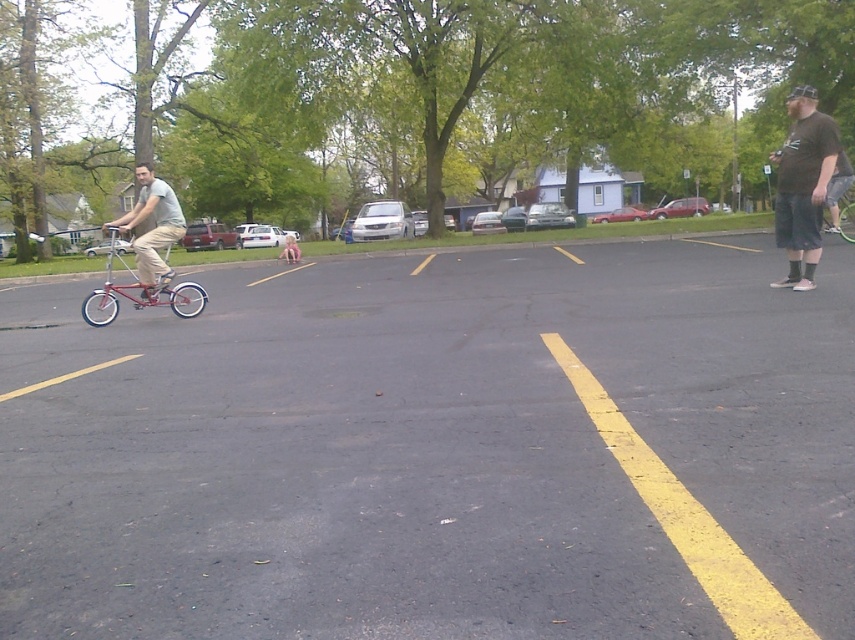
You are a GUI agent. You are given a task and a screenshot of the screen. Output one action in this format:
    pyautogui.click(x=<x>, y=<y>)
    Task: Click on the metallic silver bicycle at left
    
    Given the screenshot: What is the action you would take?
    pyautogui.click(x=152, y=227)

Is metallic silver bicycle at left taller than metallic silver bicycle at right?

Yes.

Who is more distant from viewer, (137, 172) or (828, 225)?

The point (828, 225) is behind.

I want to click on metallic silver bicycle at left, so click(152, 227).

In the scene shown: Is the position of metallic silver bicycle at left less distant than that of shiny red bicycle at left?

Yes, it is in front of shiny red bicycle at left.

Who is lower down, metallic silver bicycle at left or shiny red bicycle at left?

shiny red bicycle at left is lower down.

Locate an element on the screen. This screenshot has width=855, height=640. metallic silver bicycle at left is located at coordinates (152, 227).

At what (x,y) coordinates should I click in order to perform the action: click on metallic silver bicycle at left. Please return your answer as a coordinate pair (x, y). This screenshot has width=855, height=640. Looking at the image, I should click on (152, 227).

Is black asphalt parking lot at center to the right of metallic silver bicycle at left from the viewer's perspective?

Indeed, black asphalt parking lot at center is positioned on the right side of metallic silver bicycle at left.

Between point (534, 333) and point (145, 168), which one is positioned in front?

Point (534, 333) is more forward.

The image size is (855, 640). I want to click on black asphalt parking lot at center, so click(x=426, y=445).

Image resolution: width=855 pixels, height=640 pixels. Identify the location of black asphalt parking lot at center. pyautogui.click(x=426, y=445).